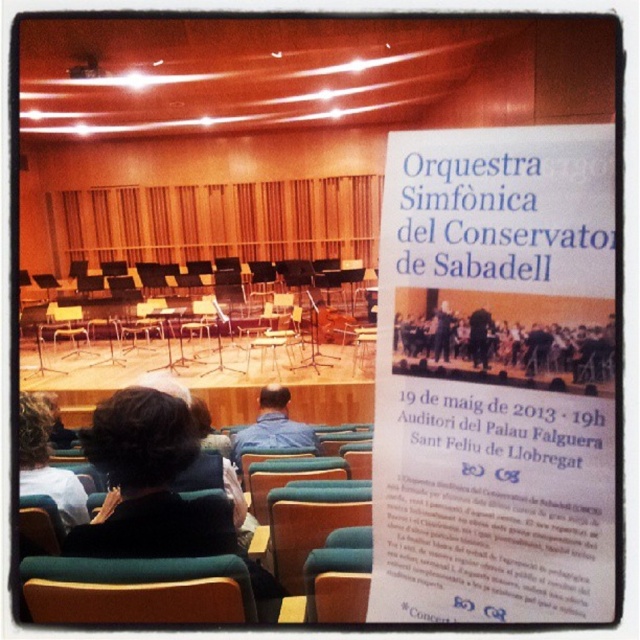
Measure the distance from green fabric chair at lower center to blue denim shirt at center.

A distance of 2.36 meters exists between green fabric chair at lower center and blue denim shirt at center.

Is green fabric chair at lower center in front of blue denim shirt at center?

Yes, green fabric chair at lower center is closer to the viewer.

Which is behind, point (218, 573) or point (236, 464)?

The point (236, 464) is more distant.

Locate an element on the screen. green fabric chair at lower center is located at coordinates (140, 570).

Is white paper at upper center closer to the viewer compared to dark brown hair at lower left?

Yes.

Can you confirm if white paper at upper center is smaller than dark brown hair at lower left?

Correct, white paper at upper center occupies less space than dark brown hair at lower left.

Which is in front, point (515, 525) or point (22, 445)?

Point (515, 525) is in front.

In order to click on white paper at upper center in this screenshot , I will do `click(496, 376)`.

This screenshot has height=640, width=640. What are the coordinates of `dark blue suit at center` in the screenshot? It's located at (508, 339).

Can you confirm if dark blue suit at center is taller than dark brown hair at lower left?

Incorrect, dark blue suit at center's height is not larger of dark brown hair at lower left's.

Does point (518, 323) lie in front of point (48, 474)?

Yes.

Image resolution: width=640 pixels, height=640 pixels. I want to click on dark blue suit at center, so click(x=508, y=339).